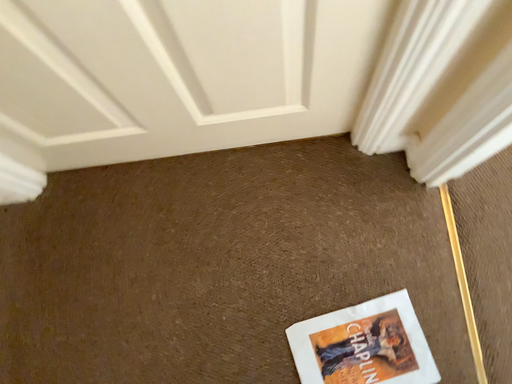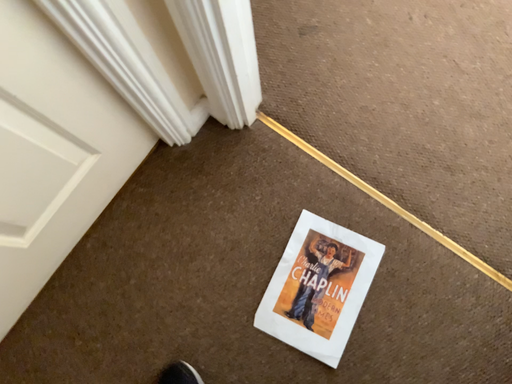
Question: Which way did the camera rotate in the video?

Choices:
 (A) rotated left
 (B) rotated right

Answer: (B)